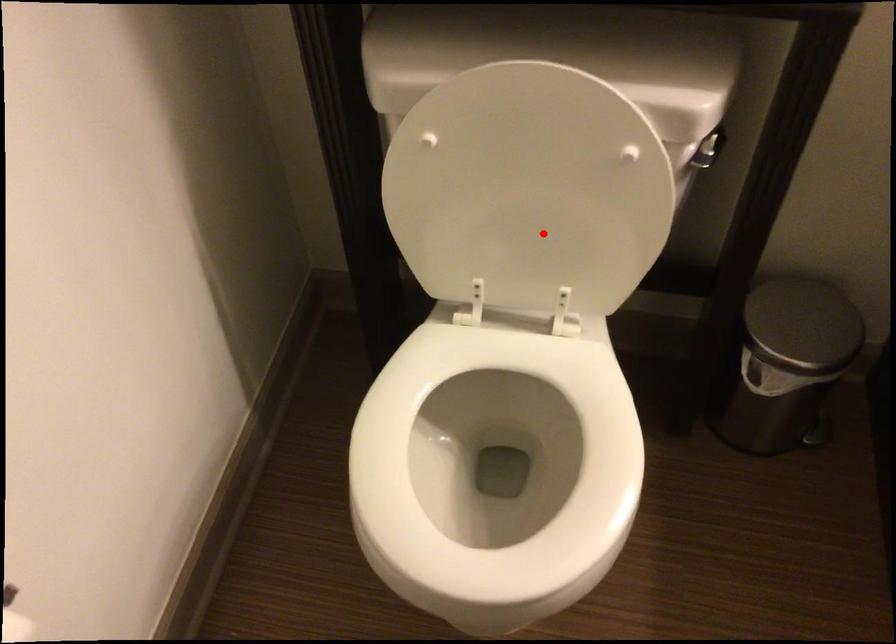
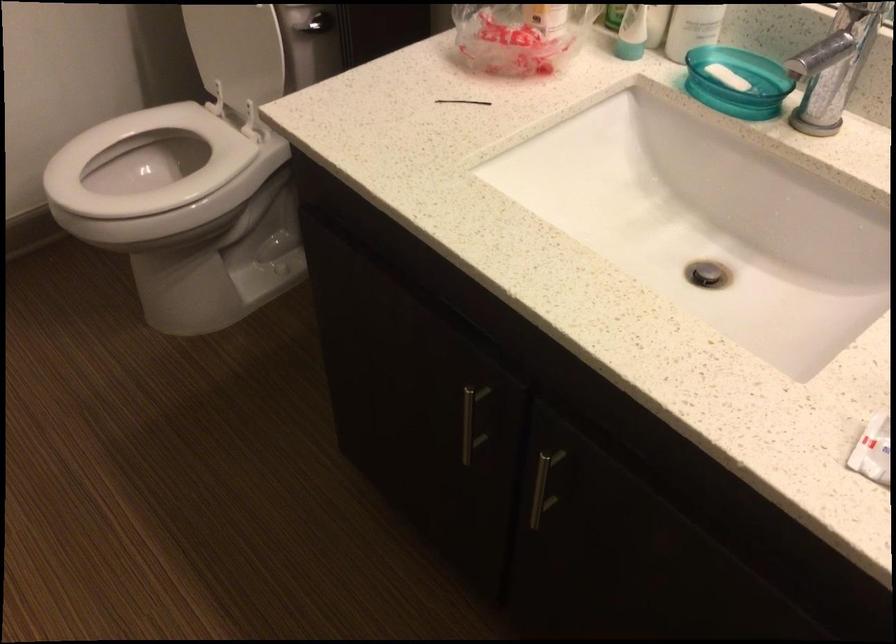
Question: I am providing you with two images of the same scene from different viewpoints. In image1, a red point is highlighted. Considering the same 3D point in image2, which of the following is correct?

Choices:
 (A) It is closer
 (B) It is farther

Answer: (B)